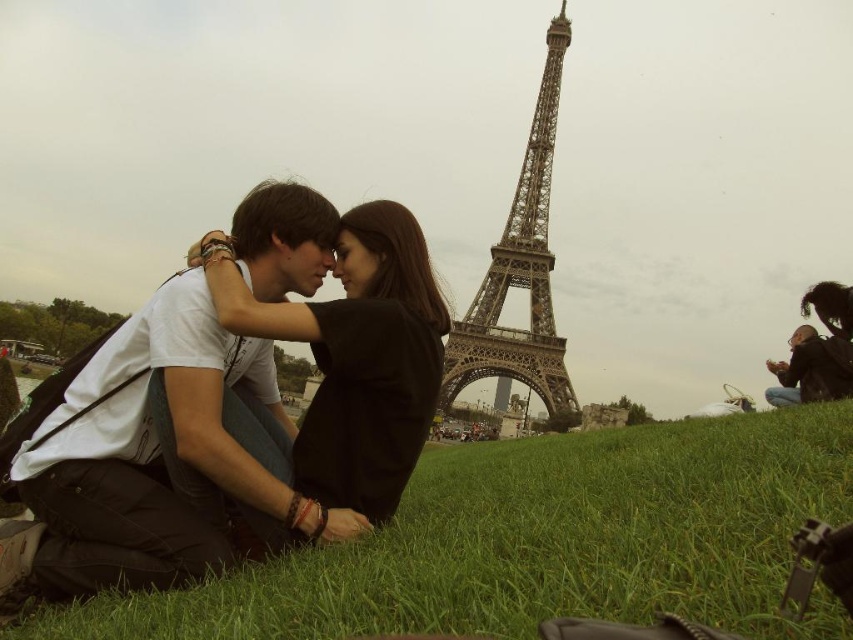
Question: Is green grassy at lower center behind dark brown leather jacket at lower right?

Choices:
 (A) no
 (B) yes

Answer: (A)

Question: Which point is closer to the camera?

Choices:
 (A) (247, 209)
 (B) (549, 360)

Answer: (B)

Question: Can you confirm if white matte t-shirt at center is wider than green grassy at lower center?

Choices:
 (A) no
 (B) yes

Answer: (A)

Question: Which point is farther to the camera?

Choices:
 (A) metallic gray eiffel tower at center
 (B) black matte dress at center
 (C) white matte t-shirt at center

Answer: (B)

Question: Can you confirm if white matte t-shirt at center is smaller than green grassy at lower center?

Choices:
 (A) yes
 (B) no

Answer: (A)

Question: Which point appears farthest from the camera in this image?

Choices:
 (A) (393, 362)
 (B) (271, 524)
 (C) (699, 420)

Answer: (C)